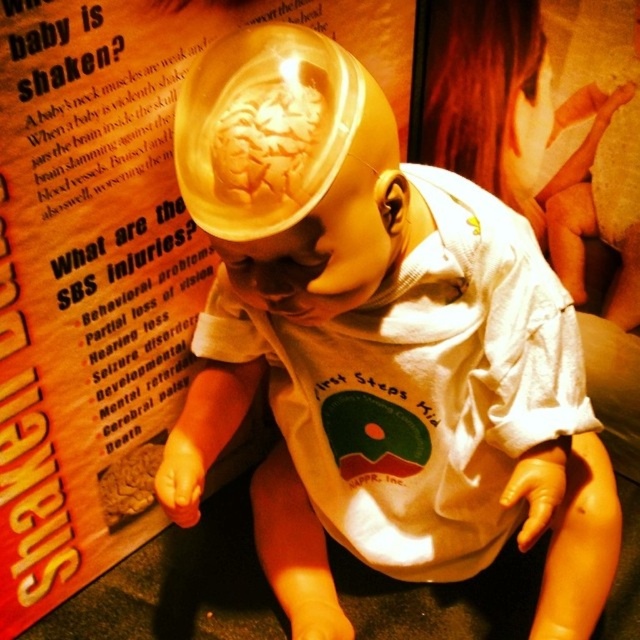
Question: Can you confirm if matte plastic head at center is thinner than matte paper poster at center?

Choices:
 (A) yes
 (B) no

Answer: (A)

Question: Does matte plastic head at center lie behind matte paper poster at center?

Choices:
 (A) no
 (B) yes

Answer: (A)

Question: Does matte plastic head at center have a greater width compared to matte paper poster at center?

Choices:
 (A) yes
 (B) no

Answer: (B)

Question: Which point is farther to the camera?

Choices:
 (A) (90, 506)
 (B) (356, 115)

Answer: (A)

Question: Which point is closer to the camera?

Choices:
 (A) matte paper poster at center
 (B) matte plastic head at center

Answer: (B)